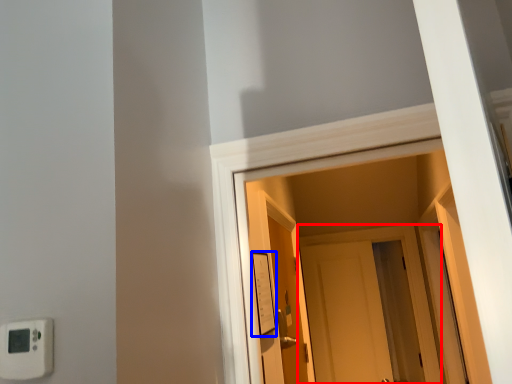
Question: Which point is closer to the camera, door (highlighted by a red box) or light switch (highlighted by a blue box)?

Choices:
 (A) door
 (B) light switch

Answer: (B)